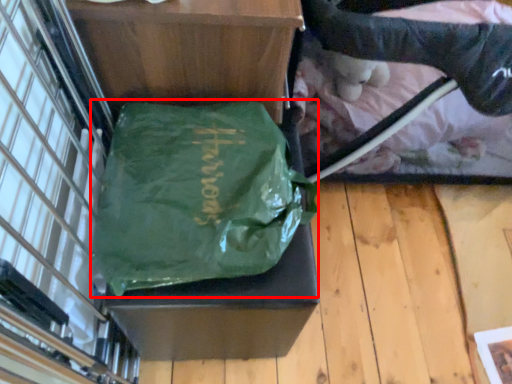
Question: From the image, what is the correct spatial relationship of tote bag (annotated by the red box) in relation to baby carriage?

Choices:
 (A) left
 (B) right

Answer: (A)